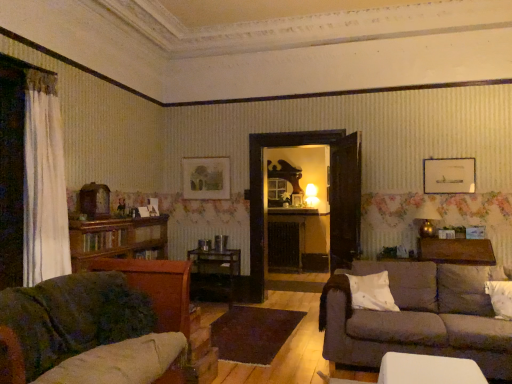
Question: Is velvet green couch at lower left, which is the first studio couch from front to back, smaller than white matte pillow at center, the second pillow positioned from the right?

Choices:
 (A) yes
 (B) no

Answer: (B)

Question: From a real-world perspective, is velvet green couch at lower left, arranged as the first studio couch when viewed from the left, physically below white matte pillow at center, the second pillow positioned from the right?

Choices:
 (A) no
 (B) yes

Answer: (B)

Question: From a real-world perspective, does velvet green couch at lower left, arranged as the 2th studio couch when viewed from the back, stand above white matte pillow at center, which is counted as the first pillow, starting from the left?

Choices:
 (A) no
 (B) yes

Answer: (A)

Question: From the image's perspective, is velvet green couch at lower left, arranged as the first studio couch when viewed from the left, above white matte pillow at center, the second pillow positioned from the right?

Choices:
 (A) no
 (B) yes

Answer: (A)

Question: Is velvet green couch at lower left, arranged as the 2th studio couch when viewed from the back, facing towards white matte pillow at center, which is counted as the first pillow, starting from the left?

Choices:
 (A) no
 (B) yes

Answer: (A)

Question: From their relative heights in the image, would you say white matte pillow at center, which is counted as the first pillow, starting from the left, is taller or shorter than wooden glossy table at center, which is counted as the 1th table, starting from the bottom?

Choices:
 (A) tall
 (B) short

Answer: (B)

Question: Considering the positions of point (361, 278) and point (200, 281), is point (361, 278) closer or farther from the camera than point (200, 281)?

Choices:
 (A) farther
 (B) closer

Answer: (B)

Question: Looking at the image, does white matte pillow at center, the second pillow positioned from the right, seem bigger or smaller compared to wooden glossy table at center, which appears as the first table when viewed from the back?

Choices:
 (A) big
 (B) small

Answer: (B)

Question: From a real-world perspective, is white matte pillow at center, which is counted as the first pillow, starting from the left, above or below wooden glossy table at center, which appears as the first table when viewed from the back?

Choices:
 (A) above
 (B) below

Answer: (A)

Question: Based on their positions, is matte white picture frame at upper right, which ranks as the second picture frame in back-to-front order, located to the left or right of white matte pillow at center, which is counted as the first pillow, starting from the left?

Choices:
 (A) right
 (B) left

Answer: (A)

Question: From a real-world perspective, is matte white picture frame at upper right, which is the 1th picture frame in right-to-left order, positioned above or below white matte pillow at center, which is counted as the first pillow, starting from the left?

Choices:
 (A) below
 (B) above

Answer: (B)

Question: In terms of height, does matte white picture frame at upper right, the first picture frame positioned from the front, look taller or shorter compared to white matte pillow at center, the second pillow positioned from the right?

Choices:
 (A) tall
 (B) short

Answer: (A)

Question: Does point (441, 163) appear closer or farther from the camera than point (353, 274)?

Choices:
 (A) farther
 (B) closer

Answer: (A)

Question: In the image, is velvet green couch at lower left, the 2th studio couch in the right-to-left sequence, positioned in front of or behind wooden glossy table at center, which is counted as the 1th table, starting from the bottom?

Choices:
 (A) behind
 (B) front

Answer: (B)

Question: Do you think velvet green couch at lower left, the 2th studio couch in the right-to-left sequence, is within wooden glossy table at center, the second table in the top-to-bottom sequence, or outside of it?

Choices:
 (A) inside
 (B) outside

Answer: (B)